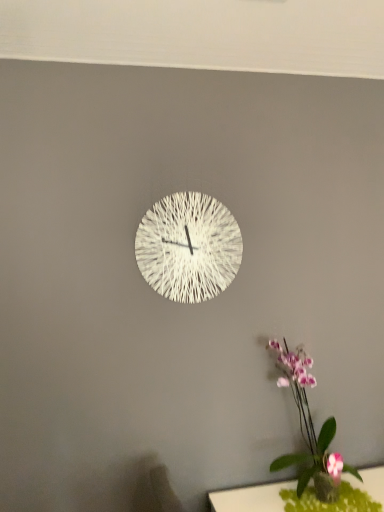
Question: From a real-world perspective, is green felt table at lower right over white woven clock at center?

Choices:
 (A) yes
 (B) no

Answer: (B)

Question: Is green felt table at lower right to the left of white woven clock at center from the viewer's perspective?

Choices:
 (A) no
 (B) yes

Answer: (A)

Question: Are green felt table at lower right and white woven clock at center beside each other?

Choices:
 (A) yes
 (B) no

Answer: (B)

Question: Could white woven clock at center be considered to be inside green felt table at lower right?

Choices:
 (A) no
 (B) yes

Answer: (A)

Question: Is green felt table at lower right positioned far away from white woven clock at center?

Choices:
 (A) yes
 (B) no

Answer: (B)

Question: In the image, is purple-pink orchid at lower right on the left side or the right side of green felt table at lower right?

Choices:
 (A) left
 (B) right

Answer: (A)

Question: Is purple-pink orchid at lower right inside the boundaries of green felt table at lower right, or outside?

Choices:
 (A) outside
 (B) inside

Answer: (A)

Question: From the image's perspective, is purple-pink orchid at lower right positioned above or below green felt table at lower right?

Choices:
 (A) above
 (B) below

Answer: (A)

Question: From a real-world perspective, is purple-pink orchid at lower right positioned above or below green felt table at lower right?

Choices:
 (A) below
 (B) above

Answer: (B)

Question: Does point [x=192, y=260] appear closer or farther from the camera than point [x=291, y=373]?

Choices:
 (A) closer
 (B) farther

Answer: (B)

Question: Is white woven clock at center to the left or to the right of purple-pink orchid at lower right in the image?

Choices:
 (A) right
 (B) left

Answer: (B)

Question: Is white woven clock at center taller or shorter than purple-pink orchid at lower right?

Choices:
 (A) tall
 (B) short

Answer: (B)

Question: From a real-world perspective, is white woven clock at center above or below purple-pink orchid at lower right?

Choices:
 (A) above
 (B) below

Answer: (A)

Question: Is point (274, 501) closer or farther from the camera than point (288, 461)?

Choices:
 (A) farther
 (B) closer

Answer: (B)

Question: From a real-world perspective, relative to purple-pink orchid at lower right, is green felt table at lower right vertically above or below?

Choices:
 (A) above
 (B) below

Answer: (B)